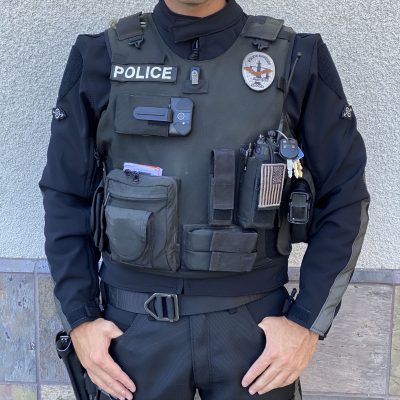
The width and height of the screenshot is (400, 400). Find the location of `phone`. phone is located at coordinates (172, 114).